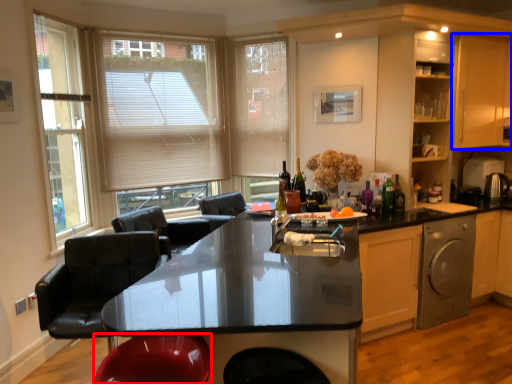
Question: Which object is further to the camera taking this photo, swivel chair (highlighted by a red box) or cabinetry (highlighted by a blue box)?

Choices:
 (A) swivel chair
 (B) cabinetry

Answer: (B)